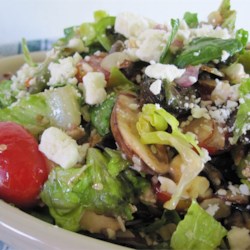
Image resolution: width=250 pixels, height=250 pixels. I want to click on cloth behind the salad bowl, so click(36, 44).